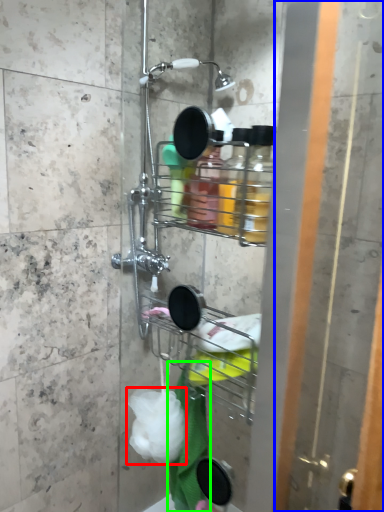
Question: Which is nearer to the plastic (highlighted by a red box)? screen door (highlighted by a blue box) or bath towel (highlighted by a green box).

Choices:
 (A) screen door
 (B) bath towel

Answer: (B)